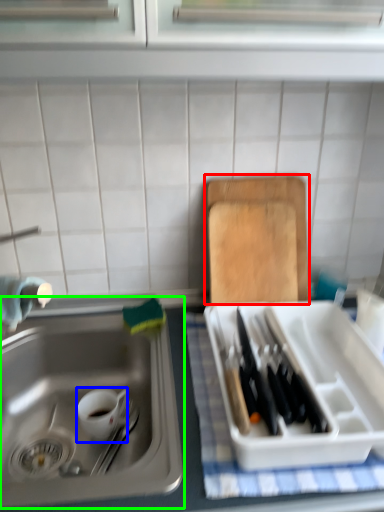
Question: Based on their relative distances, which object is nearer to cutting board (highlighted by a red box)? Choose from tableware (highlighted by a blue box) and sink (highlighted by a green box).

Choices:
 (A) tableware
 (B) sink

Answer: (B)